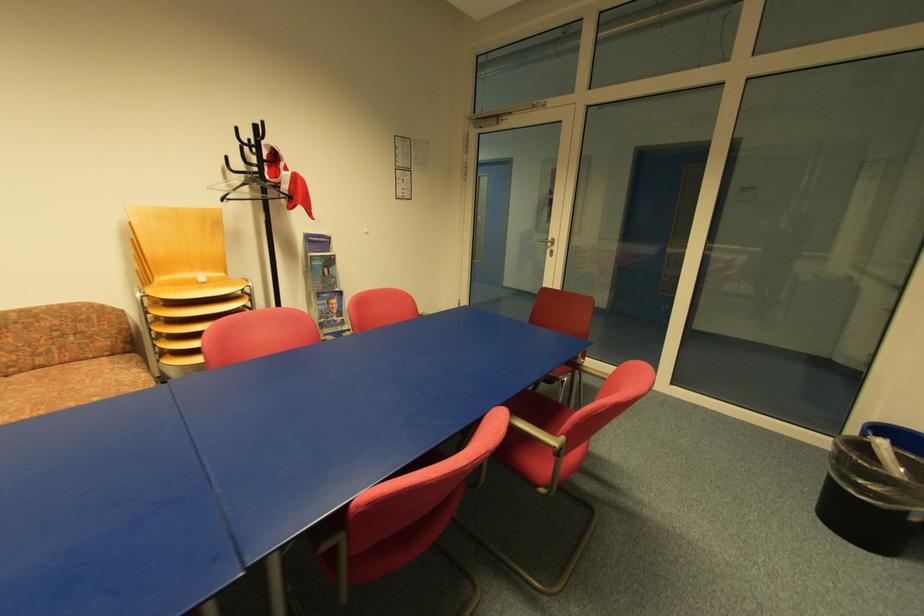
Where would you plac the black trash can? Please return your answer as a coordinate pair (x, y).

(871, 495)